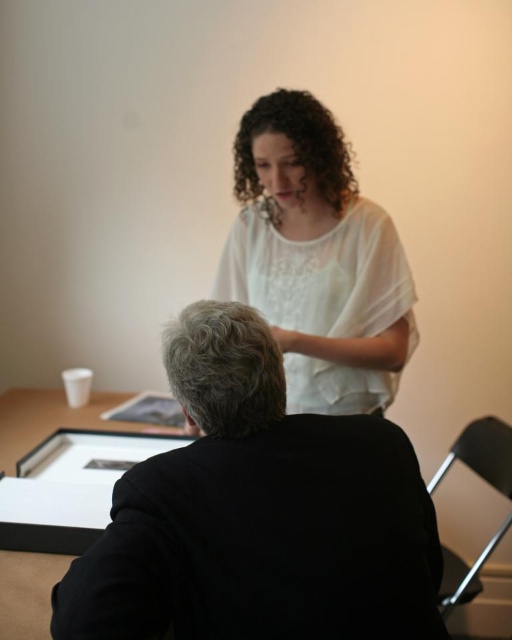
Question: Which of the following is the closest to the observer?

Choices:
 (A) white sheer blouse at upper center
 (B) black matte jacket at lower center

Answer: (B)

Question: Does black matte jacket at lower center appear on the right side of curly brown hair at upper center?

Choices:
 (A) yes
 (B) no

Answer: (B)

Question: Which object is farther from the camera taking this photo?

Choices:
 (A) black matte jacket at lower center
 (B) gray curly hair at center
 (C) curly brown hair at upper center

Answer: (C)

Question: Does black matte jacket at lower center appear over curly brown hair at upper center?

Choices:
 (A) yes
 (B) no

Answer: (B)

Question: Is white sheer blouse at upper center below curly brown hair at upper center?

Choices:
 (A) no
 (B) yes

Answer: (B)

Question: Which of these objects is positioned farthest from the gray curly hair at center?

Choices:
 (A) white sheer blouse at upper center
 (B) curly brown hair at upper center
 (C) black matte jacket at lower center

Answer: (B)